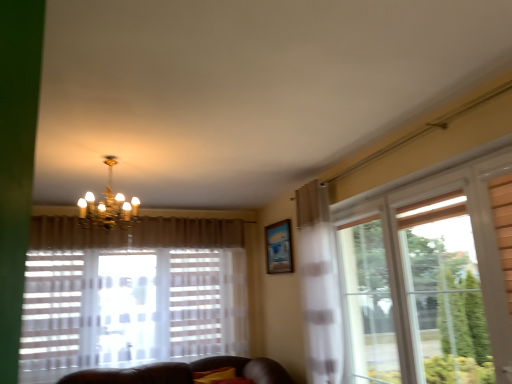
The height and width of the screenshot is (384, 512). Describe the element at coordinates (431, 276) in the screenshot. I see `translucent wood window at right` at that location.

This screenshot has height=384, width=512. I want to click on translucent wood window at right, so click(431, 276).

At what (x,y) coordinates should I click in order to perform the action: click on translucent wood window at right. Please return your answer as a coordinate pair (x, y). Looking at the image, I should click on (431, 276).